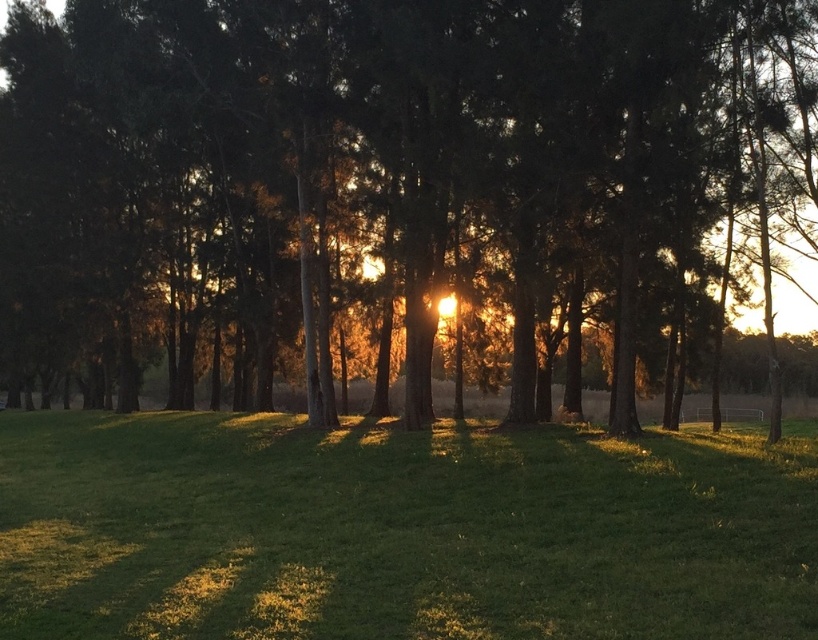
Consider the image. What is the spatial relationship between the green matte tree at center and the green grassy field at center in the forest scene?

The green matte tree at center is positioned over the green grassy field at center, meaning the tree is above the field in the scene.

You are standing in the forest scene and want to walk through the area. Since the green matte tree at center and the green grassy field at center are both in your path, which one do you think you can pass through more easily?

The green grassy field at center is easier to pass through because trees are typically solid and obstructive, while grassy fields are open areas that allow passage.